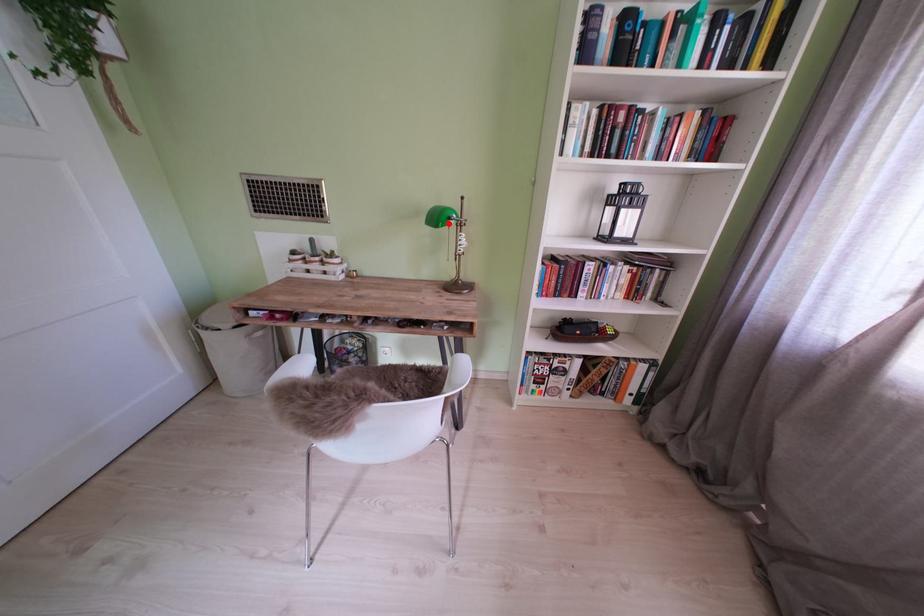
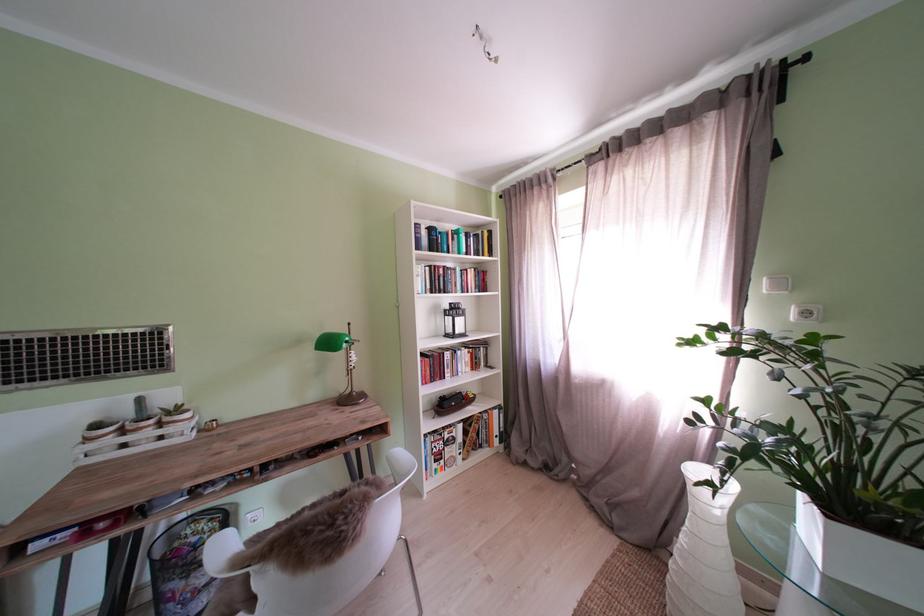
Question: A red point is marked in image1. In image2, is the corresponding 3D point closer to the camera or farther? Reply with the corresponding letter.

Choices:
 (A) The corresponding 3D point is closer.
 (B) The corresponding 3D point is farther.

Answer: (B)